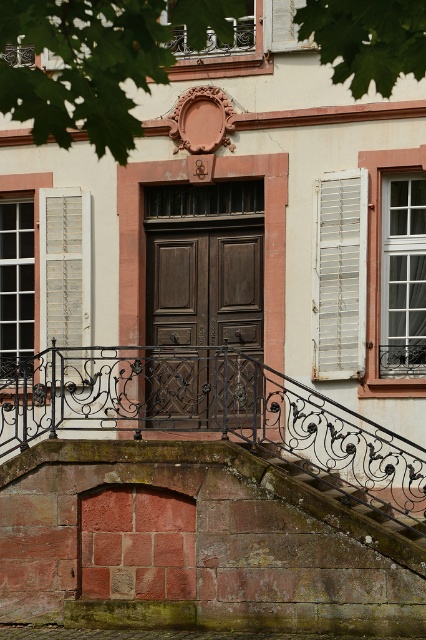
You are an architect inspecting the building facade. You notice the white painted wood shutter at right and the white wood shutter at left. Which one has a smaller width?

The white painted wood shutter at right has a smaller width than the white wood shutter at left.

You are standing in front of the building and want to locate the rusty metal balustrade at center. According to the coordinates provided, where exactly is it positioned?

The rusty metal balustrade at center is located at point [218,417].

You are a painter standing at the base of the building, and you need to paint both the white painted wood shutter at right and the white wood shutter at left. Your ladder can only reach up to 8 feet. Can you paint both shutters without moving the ladder?

The distance between the white painted wood shutter at right and the white wood shutter at left is 8.26 feet. Since your ladder can only reach up to 8 feet, you will need to move the ladder to reach both shutters.